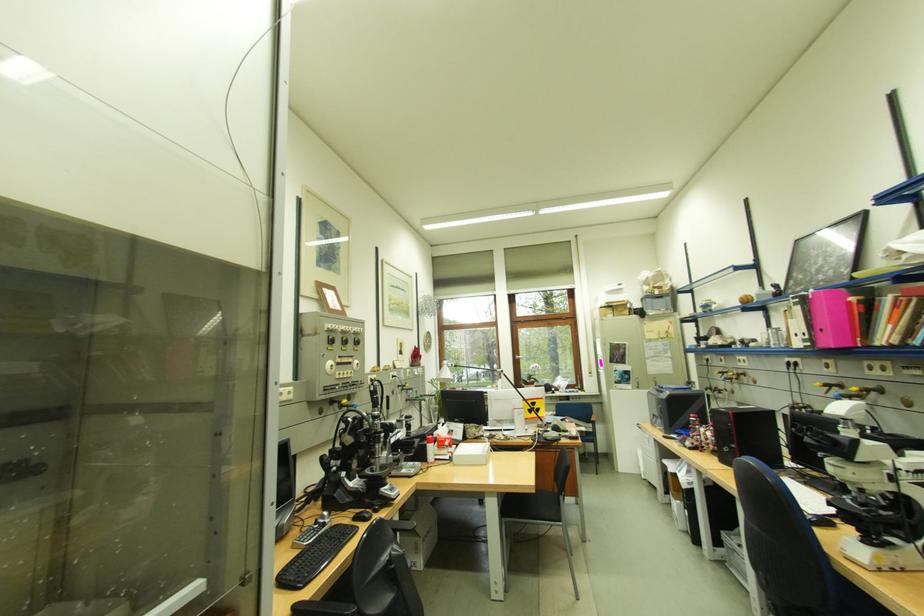
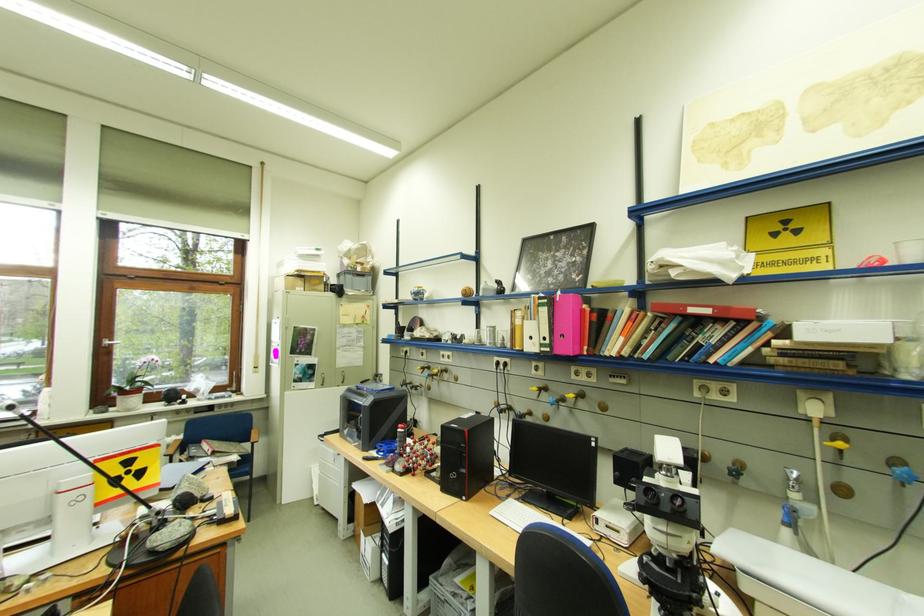
Find the pixel in the second image that matches point (528, 358) in the first image.

(117, 342)